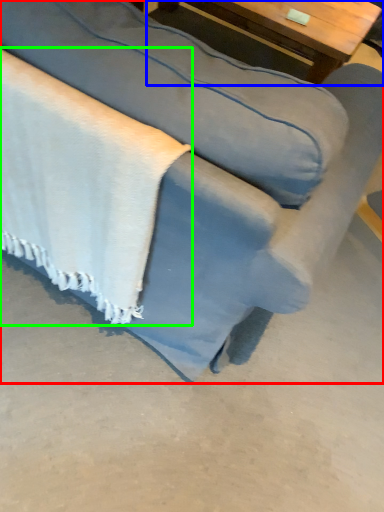
Question: Which object is positioned closest to studio couch (highlighted by a red box)? Select from table (highlighted by a blue box) and blanket (highlighted by a green box).

Choices:
 (A) table
 (B) blanket

Answer: (B)